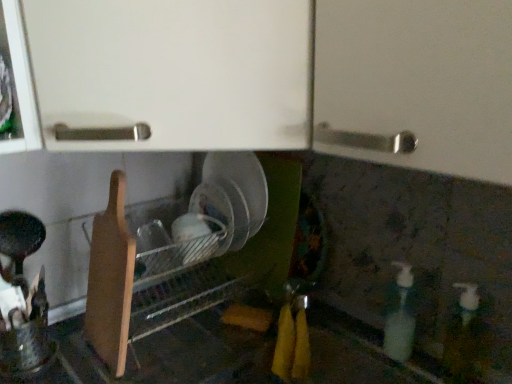
This screenshot has height=384, width=512. I want to click on white glossy bottle at lower right, the first bottle positioned from the right, so click(466, 339).

I want to click on translucent plastic soap dispenser at lower right, the 2th bottle when ordered from right to left, so click(x=400, y=318).

The image size is (512, 384). Find the location of `white glossy bottle at lower right, the first bottle positioned from the right`. white glossy bottle at lower right, the first bottle positioned from the right is located at coordinates (466, 339).

Identify the location of bottle on the right of translucent plastic soap dispenser at lower right, the 2th bottle when ordered from right to left. (466, 339).

Between white glossy bottle at lower right, which is the second bottle from left to right, and translucent plastic soap dispenser at lower right, which is the first bottle from left to right, which one has smaller width?

translucent plastic soap dispenser at lower right, which is the first bottle from left to right.

Looking at this image, does white glossy bottle at lower right, which is the second bottle from left to right, appear on the left side of translucent plastic soap dispenser at lower right, the 2th bottle when ordered from right to left?

Incorrect, white glossy bottle at lower right, which is the second bottle from left to right, is not on the left side of translucent plastic soap dispenser at lower right, the 2th bottle when ordered from right to left.

Between white glossy bottle at lower right, the first bottle positioned from the right, and translucent plastic soap dispenser at lower right, the 2th bottle when ordered from right to left, which one has smaller size?

translucent plastic soap dispenser at lower right, the 2th bottle when ordered from right to left, is smaller.

Based on the photo, could translucent plastic soap dispenser at lower right, the 2th bottle when ordered from right to left, be considered to be inside wooden cutting board at lower left?

No, translucent plastic soap dispenser at lower right, the 2th bottle when ordered from right to left, is not surrounded by wooden cutting board at lower left.

In the scene shown: Is wooden cutting board at lower left taller or shorter than translucent plastic soap dispenser at lower right, which is the first bottle from left to right?

Considering their sizes, wooden cutting board at lower left has more height than translucent plastic soap dispenser at lower right, which is the first bottle from left to right.

From the picture: In terms of size, does wooden cutting board at lower left appear bigger or smaller than translucent plastic soap dispenser at lower right, which is the first bottle from left to right?

In the image, wooden cutting board at lower left appears to be larger than translucent plastic soap dispenser at lower right, which is the first bottle from left to right.

I want to click on dish washer in front of the translucent plastic soap dispenser at lower right, which is the first bottle from left to right, so click(x=180, y=269).

From the image's perspective, is white glossy bottle at lower right, which is the second bottle from left to right, beneath wooden cutting board at lower left?

Correct, white glossy bottle at lower right, which is the second bottle from left to right, appears lower than wooden cutting board at lower left in the image.

From a real-world perspective, is white glossy bottle at lower right, the first bottle positioned from the right, positioned over wooden cutting board at lower left based on gravity?

Correct, in the physical world, white glossy bottle at lower right, the first bottle positioned from the right, is higher than wooden cutting board at lower left.

In the scene shown: Which of these two, white glossy bottle at lower right, the first bottle positioned from the right, or wooden cutting board at lower left, is thinner?

white glossy bottle at lower right, the first bottle positioned from the right.

Is wooden cutting board at lower left inside white glossy bottle at lower right, which is the second bottle from left to right?

No, white glossy bottle at lower right, which is the second bottle from left to right, does not contain wooden cutting board at lower left.

Does translucent plastic soap dispenser at lower right, which is the first bottle from left to right, have a lesser width compared to white glossy bottle at lower right, the first bottle positioned from the right?

Indeed, translucent plastic soap dispenser at lower right, which is the first bottle from left to right, has a lesser width compared to white glossy bottle at lower right, the first bottle positioned from the right.

Is point (400, 349) positioned after point (482, 345)?

Yes.

From the image's perspective, which is above, translucent plastic soap dispenser at lower right, the 2th bottle when ordered from right to left, or white glossy bottle at lower right, which is the second bottle from left to right?

translucent plastic soap dispenser at lower right, the 2th bottle when ordered from right to left.

Is wooden cutting board at lower left thinner than white glossy bottle at lower right, the first bottle positioned from the right?

No, wooden cutting board at lower left is not thinner than white glossy bottle at lower right, the first bottle positioned from the right.

From a real-world perspective, which is physically below, wooden cutting board at lower left or white glossy bottle at lower right, the first bottle positioned from the right?

wooden cutting board at lower left.

Considering the sizes of objects wooden cutting board at lower left and white glossy bottle at lower right, which is the second bottle from left to right, in the image provided, who is bigger, wooden cutting board at lower left or white glossy bottle at lower right, which is the second bottle from left to right,?

With larger size is wooden cutting board at lower left.

From the picture: From a real-world perspective, who is located higher, translucent plastic soap dispenser at lower right, the 2th bottle when ordered from right to left, or wooden cutting board at lower left?

From a 3D spatial view, wooden cutting board at lower left is above.

Is translucent plastic soap dispenser at lower right, the 2th bottle when ordered from right to left, not inside wooden cutting board at lower left?

That's correct, translucent plastic soap dispenser at lower right, the 2th bottle when ordered from right to left, is outside of wooden cutting board at lower left.

Where is `dish washer on the left of translucent plastic soap dispenser at lower right, which is the first bottle from left to right`? This screenshot has width=512, height=384. dish washer on the left of translucent plastic soap dispenser at lower right, which is the first bottle from left to right is located at coordinates (180, 269).

Find the location of a particular element. The image size is (512, 384). bottle that appears in front of the translucent plastic soap dispenser at lower right, the 2th bottle when ordered from right to left is located at coordinates (466, 339).

Where is `bottle located behind the wooden cutting board at lower left`? This screenshot has width=512, height=384. bottle located behind the wooden cutting board at lower left is located at coordinates (400, 318).

Based on their spatial positions, is wooden cutting board at lower left or white glossy bottle at lower right, which is the second bottle from left to right, further from translucent plastic soap dispenser at lower right, the 2th bottle when ordered from right to left?

Based on the image, wooden cutting board at lower left appears to be further to translucent plastic soap dispenser at lower right, the 2th bottle when ordered from right to left.

Based on the photo, considering their positions, is white glossy bottle at lower right, which is the second bottle from left to right, positioned further to wooden cutting board at lower left than translucent plastic soap dispenser at lower right, the 2th bottle when ordered from right to left?

white glossy bottle at lower right, which is the second bottle from left to right, is further to wooden cutting board at lower left.

When comparing their distances from white glossy bottle at lower right, the first bottle positioned from the right, does wooden cutting board at lower left or translucent plastic soap dispenser at lower right, the 2th bottle when ordered from right to left, seem closer?

translucent plastic soap dispenser at lower right, the 2th bottle when ordered from right to left, lies closer to white glossy bottle at lower right, the first bottle positioned from the right, than the other object.

When comparing their distances from white glossy bottle at lower right, the first bottle positioned from the right, does translucent plastic soap dispenser at lower right, the 2th bottle when ordered from right to left, or wooden cutting board at lower left seem further?

The object further to white glossy bottle at lower right, the first bottle positioned from the right, is wooden cutting board at lower left.

Considering their positions, is translucent plastic soap dispenser at lower right, the 2th bottle when ordered from right to left, positioned further to wooden cutting board at lower left than white glossy bottle at lower right, which is the second bottle from left to right?

Among the two, white glossy bottle at lower right, which is the second bottle from left to right, is located further to wooden cutting board at lower left.

Based on their spatial positions, is white glossy bottle at lower right, the first bottle positioned from the right, or wooden cutting board at lower left closer to translucent plastic soap dispenser at lower right, the 2th bottle when ordered from right to left?

white glossy bottle at lower right, the first bottle positioned from the right, is positioned closer to the anchor translucent plastic soap dispenser at lower right, the 2th bottle when ordered from right to left.

What are the coordinates of `bottle between wooden cutting board at lower left and white glossy bottle at lower right, which is the second bottle from left to right` in the screenshot? It's located at (400, 318).